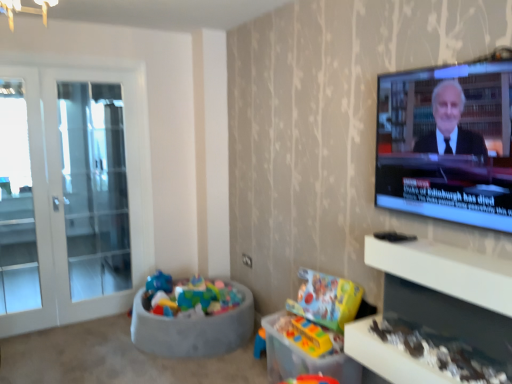
What is the approximate width of white glossy entertainment center at lower right?

white glossy entertainment center at lower right is 8.80 inches wide.

The width and height of the screenshot is (512, 384). Identify the location of white glass door at left. (73, 195).

Based on the photo, from a real-world perspective, is white glossy entertainment center at lower right positioned under white glass door at left based on gravity?

Yes, from a real-world perspective, white glossy entertainment center at lower right is below white glass door at left.

Is white glossy entertainment center at lower right facing away from white glass door at left?

No.

Which is in front, point (490, 320) or point (100, 285)?

The point (490, 320) is closer.

Consider the image. Can you confirm if white glass door at left is bigger than multicolored fabric bean bag at lower left?

Correct, white glass door at left is larger in size than multicolored fabric bean bag at lower left.

Between white glass door at left and multicolored fabric bean bag at lower left, which one has larger width?

multicolored fabric bean bag at lower left is wider.

From the image's perspective, relative to multicolored fabric bean bag at lower left, is white glass door at left above or below?

From the image's perspective, white glass door at left appears above multicolored fabric bean bag at lower left.

From a real-world perspective, is white glass door at left on multicolored fabric bean bag at lower left?

Correct, in the physical world, white glass door at left is higher than multicolored fabric bean bag at lower left.

Which is closer to the camera, (218, 334) or (437, 320)?

The point (437, 320) is closer to the camera.

Who is smaller, multicolored fabric bean bag at lower left or white glossy entertainment center at lower right?

With smaller size is white glossy entertainment center at lower right.

Does multicolored fabric bean bag at lower left appear on the left side of white glossy entertainment center at lower right?

Indeed, multicolored fabric bean bag at lower left is positioned on the left side of white glossy entertainment center at lower right.

Is multicolored fabric bean bag at lower left aimed at matte black tv at upper right?

No, multicolored fabric bean bag at lower left is not oriented towards matte black tv at upper right.

Looking at the image, does multicolored fabric bean bag at lower left seem bigger or smaller compared to matte black tv at upper right?

In the image, multicolored fabric bean bag at lower left appears to be larger than matte black tv at upper right.

Looking at this image, between multicolored fabric bean bag at lower left and matte black tv at upper right, which one has more height?

matte black tv at upper right is taller.

Considering the sizes of objects multicolored fabric bean bag at lower left and matte black tv at upper right in the image provided, who is wider, multicolored fabric bean bag at lower left or matte black tv at upper right?

With larger width is multicolored fabric bean bag at lower left.

Which is in front, matte black tv at upper right or white glossy entertainment center at lower right?

white glossy entertainment center at lower right is in front.

Is matte black tv at upper right smaller than white glossy entertainment center at lower right?

Yes, matte black tv at upper right is smaller than white glossy entertainment center at lower right.

Is matte black tv at upper right taller than white glossy entertainment center at lower right?

Indeed, matte black tv at upper right has a greater height compared to white glossy entertainment center at lower right.

Considering the sizes of objects white glass door at left and white glossy entertainment center at lower right in the image provided, who is bigger, white glass door at left or white glossy entertainment center at lower right?

With larger size is white glass door at left.

Is white glass door at left spatially inside white glossy entertainment center at lower right, or outside of it?

white glass door at left is outside white glossy entertainment center at lower right.

Identify the location of screen door located above the white glossy entertainment center at lower right (from the image's perspective). (73, 195).

Which is more to the right, white glass door at left or white glossy entertainment center at lower right?

From the viewer's perspective, white glossy entertainment center at lower right appears more on the right side.

Find the location of a particular element. Image resolution: width=512 pixels, height=384 pixels. television in front of the white glass door at left is located at coordinates (446, 143).

Based on the photo, can you confirm if white glass door at left is taller than matte black tv at upper right?

Yes, white glass door at left is taller than matte black tv at upper right.

Is point (146, 102) in front of point (412, 181)?

No, it is not.

Based on the photo, which object is more forward, white glass door at left or matte black tv at upper right?

Positioned in front is matte black tv at upper right.

I want to click on entertainment center lying on the right of white glass door at left, so 447,290.

I want to click on bean bag chair located underneath the white glass door at left (from a real-world perspective), so click(x=192, y=330).

Looking at the image, which one is located further to white glass door at left, matte black tv at upper right or multicolored fabric bean bag at lower left?

matte black tv at upper right.

Looking at this image, based on their spatial positions, is multicolored fabric bean bag at lower left or white glossy entertainment center at lower right further from white glass door at left?

white glossy entertainment center at lower right lies further to white glass door at left than the other object.

Which object lies further to the anchor point multicolored fabric bean bag at lower left, white glass door at left or white glossy entertainment center at lower right?

Among the two, white glossy entertainment center at lower right is located further to multicolored fabric bean bag at lower left.

Considering their positions, is white glossy entertainment center at lower right positioned closer to white glass door at left than multicolored fabric bean bag at lower left?

Based on the image, multicolored fabric bean bag at lower left appears to be nearer to white glass door at left.

Looking at the image, which one is located closer to multicolored fabric bean bag at lower left, white glossy entertainment center at lower right or white glass door at left?

Among the two, white glass door at left is located nearer to multicolored fabric bean bag at lower left.

Estimate the real-world distances between objects in this image. Which object is further from white glossy entertainment center at lower right, matte black tv at upper right or multicolored fabric bean bag at lower left?

multicolored fabric bean bag at lower left is positioned further to the anchor white glossy entertainment center at lower right.

Estimate the real-world distances between objects in this image. Which object is closer to white glossy entertainment center at lower right, white glass door at left or matte black tv at upper right?

Based on the image, matte black tv at upper right appears to be nearer to white glossy entertainment center at lower right.

Which object lies further to the anchor point matte black tv at upper right, multicolored fabric bean bag at lower left or white glass door at left?

The object further to matte black tv at upper right is white glass door at left.

Locate an element on the screen. This screenshot has width=512, height=384. bean bag chair between white glass door at left and white glossy entertainment center at lower right from left to right is located at coordinates (192, 330).

Where is `bean bag chair between white glass door at left and matte black tv at upper right from left to right`? bean bag chair between white glass door at left and matte black tv at upper right from left to right is located at coordinates (192, 330).

The width and height of the screenshot is (512, 384). I want to click on entertainment center located between white glass door at left and matte black tv at upper right in the left-right direction, so click(447, 290).

This screenshot has width=512, height=384. In order to click on television between white glossy entertainment center at lower right and multicolored fabric bean bag at lower left from front to back in this screenshot , I will do `click(446, 143)`.